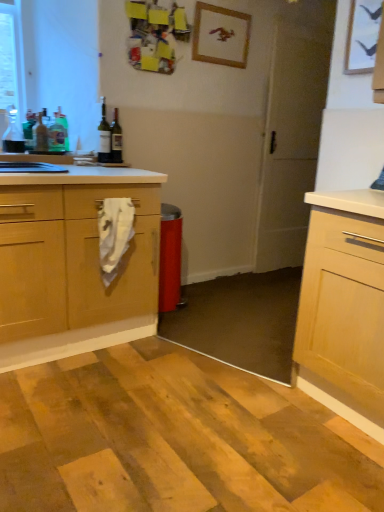
Question: From a real-world perspective, relative to wooden picture frame at upper center, is white matte screen door at center vertically above or below?

Choices:
 (A) below
 (B) above

Answer: (A)

Question: In the image, is white matte screen door at center positioned in front of or behind wooden picture frame at upper center?

Choices:
 (A) front
 (B) behind

Answer: (B)

Question: Which object is positioned farthest from the green glass bottle at upper left, the 4th bottle positioned from the right?

Choices:
 (A) wooden picture frame at upper center
 (B) white matte screen door at center
 (C) matte glass bottle at upper left, marked as the 5th bottle in a left-to-right arrangement
 (D) translucent glass bottle at left, marked as the 2th bottle in a left-to-right arrangement
 (E) green glass bottle at left, the fourth bottle viewed from the left

Answer: (B)

Question: Estimate the real-world distances between objects in this image. Which object is closer to the matte glass bottle at upper left, the 2th bottle viewed from the right?

Choices:
 (A) clear glass bottle at left, the 1th bottle from the left
 (B) white matte screen door at center
 (C) green glass bottle at left, the fourth bottle viewed from the left
 (D) wooden picture frame at upper center
 (E) white fabric towel at center

Answer: (C)